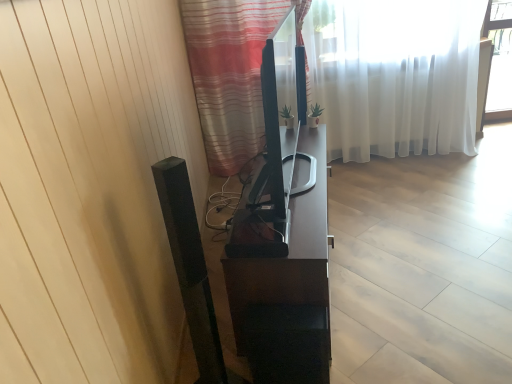
Locate an element on the screen. This screenshot has height=384, width=512. free location to the right of satin black tv stand at center is located at coordinates pos(412,237).